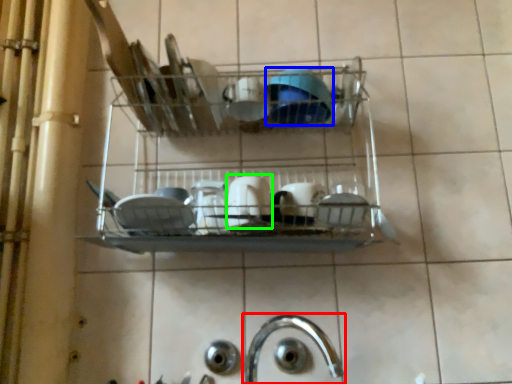
Question: Estimate the real-world distances between objects in this image. Which object is closer to tap (highlighted by a red box), tableware (highlighted by a blue box) or tableware (highlighted by a green box)?

Choices:
 (A) tableware
 (B) tableware

Answer: (B)